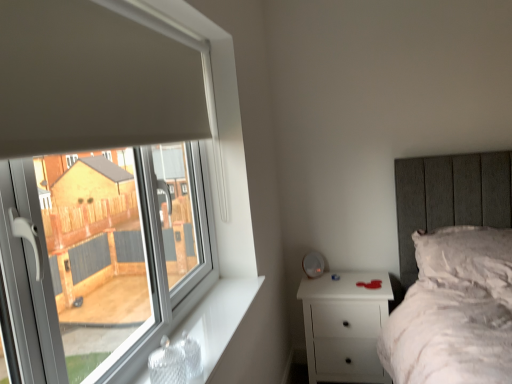
You are a GUI agent. You are given a task and a screenshot of the screen. Output one action in this format:
    pyautogui.click(x=<x>, y=<y>)
    Task: Click on the vacant area on top of white glossy window sill at lower left (from a real-world perspective)
    This screenshot has width=512, height=384.
    Given the screenshot: What is the action you would take?
    pyautogui.click(x=215, y=312)